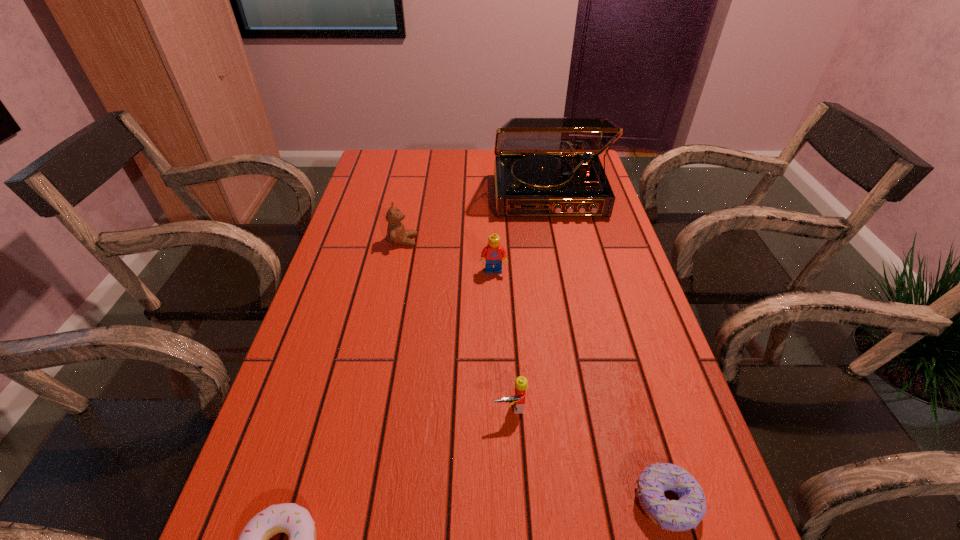
Where is `vacant area at the right edge`? The height and width of the screenshot is (540, 960). vacant area at the right edge is located at coordinates (647, 390).

Locate an element on the screen. free spot between the tallest object and the teddy bear is located at coordinates (476, 218).

I want to click on empty space that is in between the fifth nearest object and the farther Lego, so click(x=448, y=256).

Find the location of a particular element. Image resolution: width=960 pixels, height=540 pixels. free space between the farthest object and the teddy bear is located at coordinates (476, 218).

Identify the location of free space between the third nearest object and the fifth nearest object. [x=457, y=324].

Image resolution: width=960 pixels, height=540 pixels. I want to click on blank region between the second farthest object and the fourth nearest object, so click(x=448, y=256).

Locate an element on the screen. The height and width of the screenshot is (540, 960). object identified as the fourth closest to the teddy bear is located at coordinates (290, 518).

Locate which object is the closest to the fourth tallest object. Please provide its 2D coordinates. Your answer should be formatted as a tuple, i.e. [(x, y)], where the tuple contains the x and y coordinates of a point satisfying the conditions above.

[(686, 513)]

You are a GUI agent. You are given a task and a screenshot of the screen. Output one action in this format:
    pyautogui.click(x=<x>, y=<y>)
    Task: Click on the vacant area that satisfies the following two spatial constraints: 1. on the face of the right doughnut; 2. on the right side of the farther Lego
    This screenshot has height=540, width=960.
    Given the screenshot: What is the action you would take?
    pyautogui.click(x=501, y=502)

Find the location of a particular element. The image size is (960, 540). free space that satisfies the following two spatial constraints: 1. on the back side of the right doughnut; 2. on the face of the teddy bear is located at coordinates (589, 241).